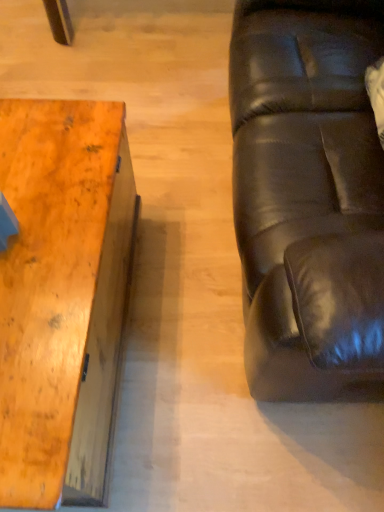
Question: In terms of size, does black leather couch at right appear bigger or smaller than wooden table at left?

Choices:
 (A) big
 (B) small

Answer: (A)

Question: From their relative heights in the image, would you say black leather couch at right is taller or shorter than wooden table at left?

Choices:
 (A) short
 (B) tall

Answer: (B)

Question: Considering the positions of black leather couch at right and wooden table at left in the image, is black leather couch at right wider or thinner than wooden table at left?

Choices:
 (A) wide
 (B) thin

Answer: (A)

Question: Is wooden table at left spatially inside black leather couch at right, or outside of it?

Choices:
 (A) inside
 (B) outside

Answer: (B)

Question: Would you say wooden table at left is to the left or to the right of black leather couch at right in the picture?

Choices:
 (A) left
 (B) right

Answer: (A)

Question: From a real-world perspective, is wooden table at left physically located above or below black leather couch at right?

Choices:
 (A) below
 (B) above

Answer: (A)

Question: From the image's perspective, is wooden table at left located above or below black leather couch at right?

Choices:
 (A) below
 (B) above

Answer: (A)